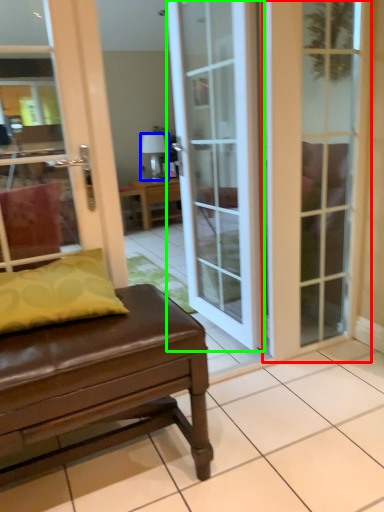
Question: Which is farther away from door (highlighted by a red box)? lamp (highlighted by a blue box) or door (highlighted by a green box)?

Choices:
 (A) lamp
 (B) door

Answer: (A)